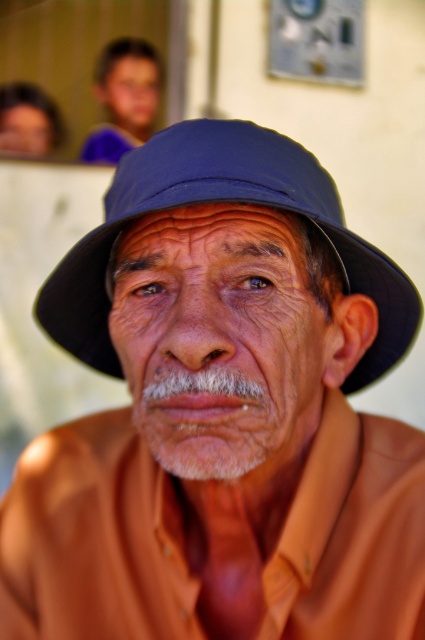
Can you confirm if blue fabric fedora at center is positioned to the right of blue fabric hat at upper center?

Indeed, blue fabric fedora at center is positioned on the right side of blue fabric hat at upper center.

Describe the element at coordinates (218, 200) in the screenshot. I see `blue fabric fedora at center` at that location.

This screenshot has height=640, width=425. Identify the location of blue fabric fedora at center. (218, 200).

At what (x,y) coordinates should I click in order to perform the action: click on blue fabric fedora at center. Please return your answer as a coordinate pair (x, y). The width and height of the screenshot is (425, 640). Looking at the image, I should click on (218, 200).